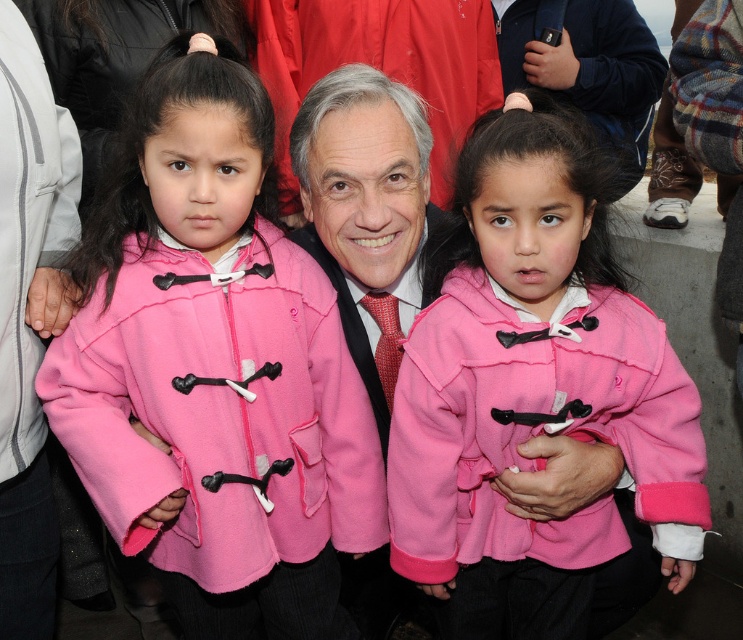
You are helping a photographer organize a group photo. The photographer wants to ensure the matte pink coat at left and the pink fleece jacket at center are visible in the final shot. Based on their positions, which one should be moved back to avoid blocking the other?

The matte pink coat at left is in front of the pink fleece jacket at center, so moving the matte pink coat at left back would allow the pink fleece jacket at center to be visible without obstruction.

You are a photographer trying to capture a closeup of the pink fleece jacket at center. The camera you are using has a focal length of 50mm and an aperture of f2.8. You are currently standing at point 0.5, 0.7. Do you need to move closer or farther away from the jacket to focus on it properly?

Since the pink fleece jacket at center is located at point (533, 388) and you are at point (519, 320), you need to move slightly closer to the jacket to focus properly. The jacket is positioned to the right and slightly above your current position, so adjusting your position towards those coordinates will help achieve focus.